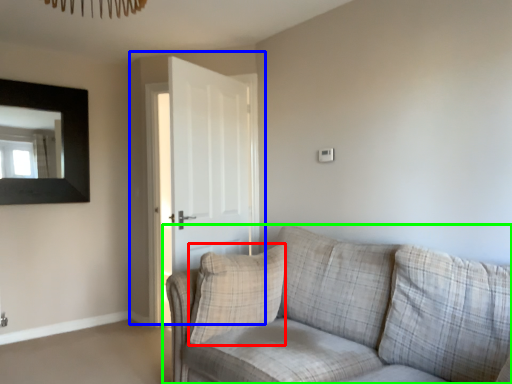
Question: Based on their relative distances, which object is farther from pillow (highlighted by a red box)? Choose from door (highlighted by a blue box) and studio couch (highlighted by a green box).

Choices:
 (A) door
 (B) studio couch

Answer: (A)